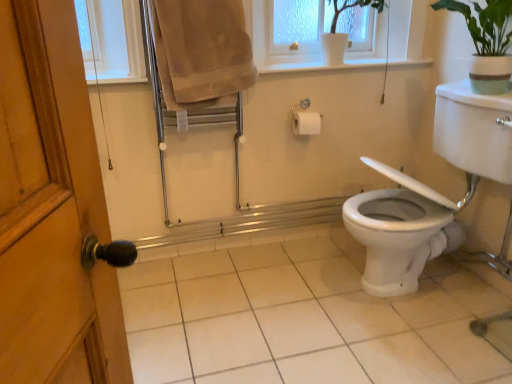
The height and width of the screenshot is (384, 512). I want to click on white glossy sink at right, so click(433, 190).

What do you see at coordinates (305, 318) in the screenshot?
I see `black rubber grab bar at lower left` at bounding box center [305, 318].

Find the location of a particular element. Image resolution: width=512 pixels, height=384 pixels. white ceramic pot at upper center is located at coordinates (298, 25).

Where is `white glossy sink at right`? Image resolution: width=512 pixels, height=384 pixels. white glossy sink at right is located at coordinates (433, 190).

From the image's perspective, between beige cotton towel at upper center and white ceramic pot at upper center, who is located below?

beige cotton towel at upper center.

You are a GUI agent. You are given a task and a screenshot of the screen. Output one action in this format:
    pyautogui.click(x=<x>, y=<y>)
    Task: Click on the window frame above the beige cotton towel at upper center (from the image's perspective)
    The height and width of the screenshot is (384, 512).
    Given the screenshot: What is the action you would take?
    pyautogui.click(x=298, y=25)

Considering the relative sizes of beige cotton towel at upper center and white ceramic pot at upper center in the image provided, is beige cotton towel at upper center thinner than white ceramic pot at upper center?

Correct, the width of beige cotton towel at upper center is less than that of white ceramic pot at upper center.

In the scene shown: From a real-world perspective, is black rubber grab bar at lower left over beige cotton towel at upper center?

No, from a real-world perspective, black rubber grab bar at lower left is not on top of beige cotton towel at upper center.

From the image's perspective, which object appears higher, black rubber grab bar at lower left or beige cotton towel at upper center?

beige cotton towel at upper center is shown above in the image.

Is the depth of black rubber grab bar at lower left less than that of beige cotton towel at upper center?

Yes, black rubber grab bar at lower left is closer to the viewer.

How far apart are black rubber grab bar at lower left and beige cotton towel at upper center?

black rubber grab bar at lower left is 1.07 meters from beige cotton towel at upper center.

Locate an element on the screen. plain lying in front of the white glossy sink at right is located at coordinates (305, 318).

From a real-world perspective, which is physically below, white glossy sink at right or black rubber grab bar at lower left?

black rubber grab bar at lower left.

From the picture: From the image's perspective, is white glossy sink at right beneath black rubber grab bar at lower left?

No, from the image's perspective, white glossy sink at right is not below black rubber grab bar at lower left.

Who is smaller, white ceramic pot at upper center or beige cotton towel at upper center?

white ceramic pot at upper center.

At what (x,y) coordinates should I click in order to perform the action: click on window frame above the beige cotton towel at upper center (from a real-world perspective). Please return your answer as a coordinate pair (x, y). The image size is (512, 384). Looking at the image, I should click on (298, 25).

From the picture: Between white ceramic pot at upper center and beige cotton towel at upper center, which one is positioned behind?

white ceramic pot at upper center is behind.

In terms of height, does black rubber grab bar at lower left look taller or shorter compared to white ceramic pot at upper center?

Considering their sizes, black rubber grab bar at lower left has less height than white ceramic pot at upper center.

Considering the sizes of objects black rubber grab bar at lower left and white ceramic pot at upper center in the image provided, who is bigger, black rubber grab bar at lower left or white ceramic pot at upper center?

black rubber grab bar at lower left.

From a real-world perspective, is black rubber grab bar at lower left located beneath white ceramic pot at upper center?

Yes, from a real-world perspective, black rubber grab bar at lower left is under white ceramic pot at upper center.

Is black rubber grab bar at lower left placed right next to white ceramic pot at upper center?

No, black rubber grab bar at lower left is not touching white ceramic pot at upper center.

From the image's perspective, does beige cotton towel at upper center appear higher than white glossy sink at right?

Yes, from the image's perspective, beige cotton towel at upper center is over white glossy sink at right.

Could you tell me if beige cotton towel at upper center is facing white glossy sink at right?

No, beige cotton towel at upper center is not turned towards white glossy sink at right.

How much distance is there between beige cotton towel at upper center and white glossy sink at right?

beige cotton towel at upper center and white glossy sink at right are 37.31 inches apart from each other.

How different are the orientations of beige cotton towel at upper center and white glossy sink at right in degrees?

The facing directions of beige cotton towel at upper center and white glossy sink at right are 87.9 degrees apart.

Does white glossy sink at right have a greater width compared to white ceramic pot at upper center?

Yes, white glossy sink at right is wider than white ceramic pot at upper center.

From a real-world perspective, which object rests below the other?

white glossy sink at right is physically lower.

Is white glossy sink at right placed right next to white ceramic pot at upper center?

white glossy sink at right is not next to white ceramic pot at upper center, and they're not touching.

How much distance is there between white glossy sink at right and white ceramic pot at upper center?

white glossy sink at right is 85.50 centimeters away from white ceramic pot at upper center.

At what (x,y) coordinates should I click in order to perform the action: click on window frame above the beige cotton towel at upper center (from the image's perspective). Please return your answer as a coordinate pair (x, y). The height and width of the screenshot is (384, 512). Looking at the image, I should click on (298, 25).

Identify the location of bath towel above the black rubber grab bar at lower left (from a real-world perspective). (201, 51).

From the image, which object appears to be farther from black rubber grab bar at lower left, white glossy sink at right or white ceramic pot at upper center?

Among the two, white ceramic pot at upper center is located further to black rubber grab bar at lower left.

Considering their positions, is white ceramic pot at upper center positioned closer to white glossy sink at right than black rubber grab bar at lower left?

Based on the image, black rubber grab bar at lower left appears to be nearer to white glossy sink at right.

Based on the photo, based on their spatial positions, is white ceramic pot at upper center or beige cotton towel at upper center further from white glossy sink at right?

beige cotton towel at upper center.

Estimate the real-world distances between objects in this image. Which object is further from black rubber grab bar at lower left, white ceramic pot at upper center or beige cotton towel at upper center?

white ceramic pot at upper center.

When comparing their distances from black rubber grab bar at lower left, does beige cotton towel at upper center or white ceramic pot at upper center seem closer?

Among the two, beige cotton towel at upper center is located nearer to black rubber grab bar at lower left.

Based on their spatial positions, is beige cotton towel at upper center or black rubber grab bar at lower left further from white ceramic pot at upper center?

black rubber grab bar at lower left.

Looking at the image, which one is located closer to white ceramic pot at upper center, white glossy sink at right or beige cotton towel at upper center?

Based on the image, beige cotton towel at upper center appears to be nearer to white ceramic pot at upper center.

Which object lies nearer to the anchor point beige cotton towel at upper center, white ceramic pot at upper center or black rubber grab bar at lower left?

The object closer to beige cotton towel at upper center is white ceramic pot at upper center.

Image resolution: width=512 pixels, height=384 pixels. Identify the location of sink between beige cotton towel at upper center and black rubber grab bar at lower left in the up-down direction. (433, 190).

Identify the location of sink between white ceramic pot at upper center and black rubber grab bar at lower left in the vertical direction. (433, 190).

Locate an element on the screen. window frame situated between beige cotton towel at upper center and white glossy sink at right from left to right is located at coordinates (298, 25).

What are the coordinates of `bath towel between white ceramic pot at upper center and black rubber grab bar at lower left vertically` in the screenshot? It's located at (201, 51).